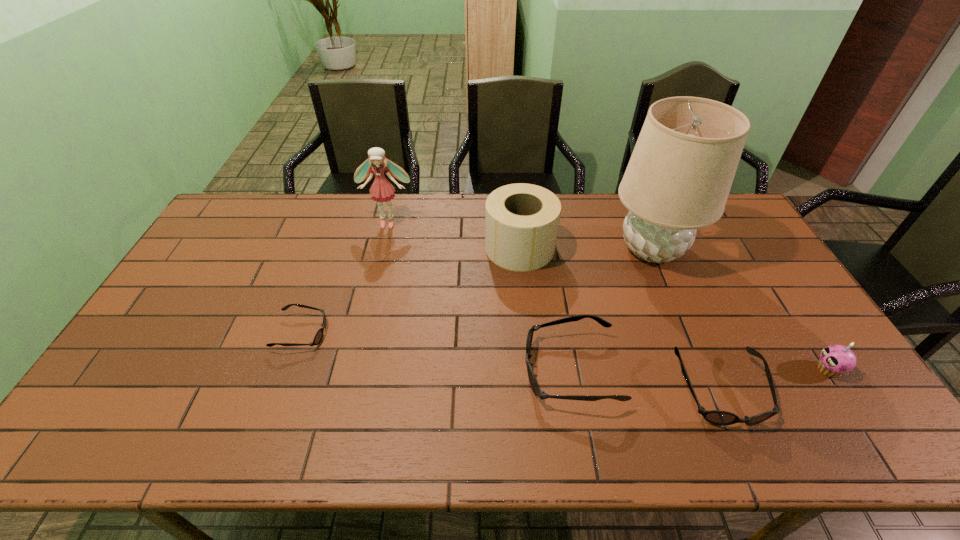
Where is `blank space at the near left corner of the desktop`? blank space at the near left corner of the desktop is located at coordinates (163, 383).

Locate an element on the screen. The image size is (960, 540). vacant area that lies between the lampshade and the third tallest object is located at coordinates (586, 248).

Where is `vacant area that lies between the sixth tallest object and the second sunglasses from right to left`? vacant area that lies between the sixth tallest object and the second sunglasses from right to left is located at coordinates (645, 380).

In order to click on vacant point located between the fourth shortest object and the second sunglasses from left to right in this screenshot , I will do `click(699, 370)`.

This screenshot has height=540, width=960. Identify the location of vacant point located between the sixth tallest object and the toilet tissue. (620, 319).

I want to click on vacant point located between the second object from left to right and the leftmost sunglasses, so click(345, 278).

The image size is (960, 540). In order to click on blank region between the doll and the second sunglasses from right to left in this screenshot , I will do `click(479, 296)`.

The height and width of the screenshot is (540, 960). I want to click on unoccupied area between the leftmost object and the second sunglasses from right to left, so click(x=436, y=352).

You are a GUI agent. You are given a task and a screenshot of the screen. Output one action in this format:
    pyautogui.click(x=<x>, y=<y>)
    Task: Click on the free space between the shortest sunglasses and the toilet tissue
    
    Given the screenshot: What is the action you would take?
    tap(411, 291)

What are the coordinates of `free space between the second shortest object and the third tallest object` in the screenshot? It's located at (620, 319).